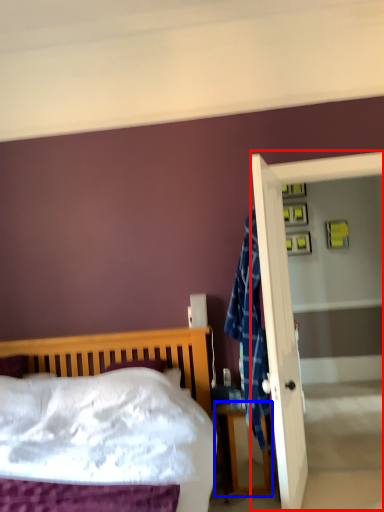
Question: Which object is closer to the camera taking this photo, screen door (highlighted by a red box) or nightstand (highlighted by a blue box)?

Choices:
 (A) screen door
 (B) nightstand

Answer: (B)